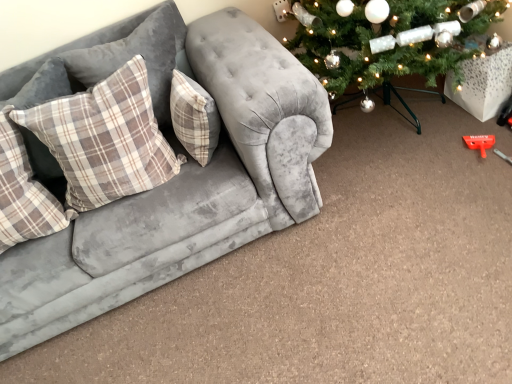
I want to click on vacant space situated above plaid fabric pillow at center, the first pillow in the right-to-left sequence (from a real-world perspective), so click(184, 86).